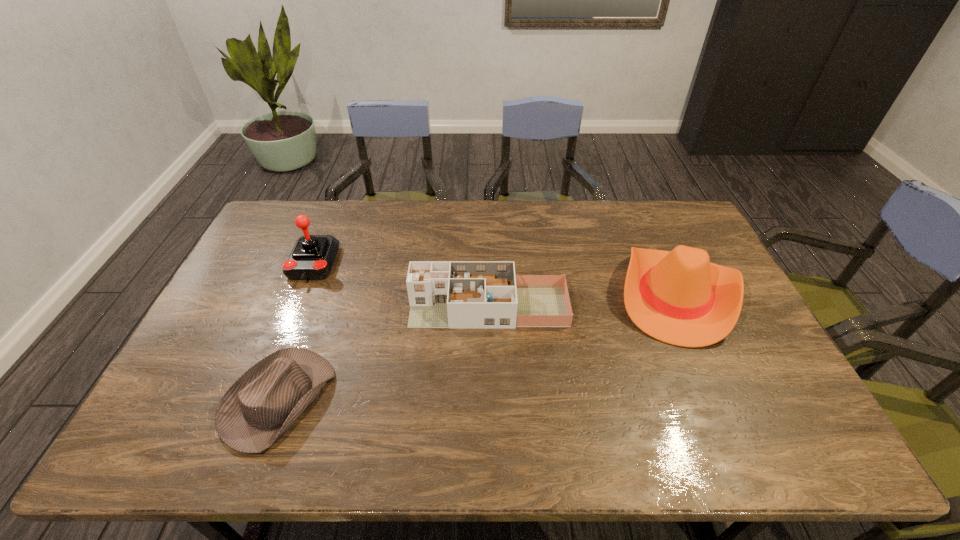
Locate an element on the screen. This screenshot has width=960, height=540. object at the near edge is located at coordinates (264, 402).

At what (x,y) coordinates should I click in order to perform the action: click on joystick present at the left edge. Please return your answer as a coordinate pair (x, y). This screenshot has height=540, width=960. Looking at the image, I should click on (312, 257).

Locate an element on the screen. The width and height of the screenshot is (960, 540). fedora that is at the left edge is located at coordinates (264, 402).

What are the coordinates of `object situated at the right edge` in the screenshot? It's located at (679, 297).

You are a GUI agent. You are given a task and a screenshot of the screen. Output one action in this format:
    pyautogui.click(x=<x>, y=<y>)
    Task: Click on the object located in the near left corner section of the desktop
    
    Given the screenshot: What is the action you would take?
    pyautogui.click(x=264, y=402)

In the image, there is a desktop. Where is `free space at the far edge`? free space at the far edge is located at coordinates (342, 201).

Where is `free region at the near edge of the desktop`? This screenshot has height=540, width=960. free region at the near edge of the desktop is located at coordinates (536, 441).

You are a GUI agent. You are given a task and a screenshot of the screen. Output one action in this format:
    pyautogui.click(x=<x>, y=<y>)
    Task: Click on the blank space at the left edge of the desktop
    
    Given the screenshot: What is the action you would take?
    pyautogui.click(x=188, y=376)

This screenshot has width=960, height=540. Identify the location of vacant space at the right edge of the desktop. (702, 248).

This screenshot has width=960, height=540. In the image, there is a desktop. Identify the location of vacant space at the far left corner. (271, 221).